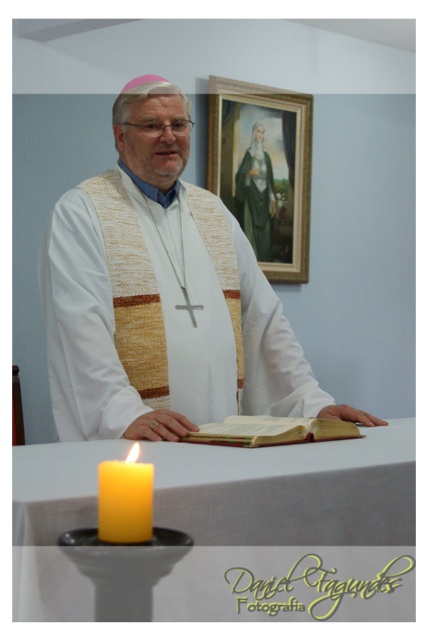
Can you confirm if woven fabric vest at center is smaller than gold-framed painting at upper center?

Incorrect, woven fabric vest at center is not smaller in size than gold-framed painting at upper center.

Which is in front, point (216, 333) or point (270, 161)?

Point (216, 333) is more forward.

The image size is (428, 640). Find the location of `woven fabric vest at center`. woven fabric vest at center is located at coordinates (82, 326).

Which of these two, yellow wax candle at lower left or green velvet robe at upper center, stands shorter?

yellow wax candle at lower left is shorter.

Between yellow wax candle at lower left and green velvet robe at upper center, which one appears on the left side from the viewer's perspective?

yellow wax candle at lower left is more to the left.

You are a GUI agent. You are given a task and a screenshot of the screen. Output one action in this format:
    pyautogui.click(x=<x>, y=<y>)
    Task: Click on the yellow wax candle at lower left
    This screenshot has width=428, height=640.
    Given the screenshot: What is the action you would take?
    click(124, 499)

Does point (80, 419) come closer to viewer compared to point (259, 202)?

That is True.

Looking at this image, can you confirm if woven fabric vest at center is positioned to the right of green velvet robe at upper center?

No, woven fabric vest at center is not to the right of green velvet robe at upper center.

The width and height of the screenshot is (428, 640). What are the coordinates of `woven fabric vest at center` in the screenshot? It's located at (82, 326).